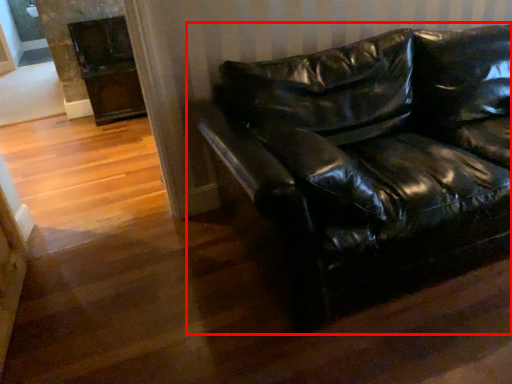
Question: From the image's perspective, where is studio couch (annotated by the red box) located relative to fireplace?

Choices:
 (A) above
 (B) below

Answer: (B)